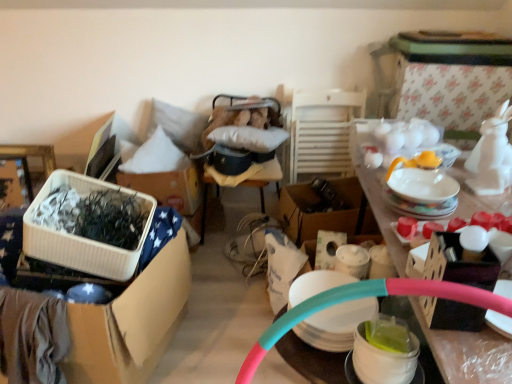
Question: Is cardboard box at center, placed as the first box when sorted from back to front, oriented away from white glossy table at upper right?

Choices:
 (A) no
 (B) yes

Answer: (A)

Question: Does cardboard box at center, the 2th box viewed from the front, have a smaller size compared to white glossy table at upper right?

Choices:
 (A) no
 (B) yes

Answer: (B)

Question: Is cardboard box at center, the 2th box viewed from the front, with white glossy table at upper right?

Choices:
 (A) no
 (B) yes

Answer: (A)

Question: Is cardboard box at center, the 1th box when ordered from right to left, oriented towards white glossy table at upper right?

Choices:
 (A) yes
 (B) no

Answer: (A)

Question: Is cardboard box at center, placed as the first box when sorted from back to front, at the right side of white glossy table at upper right?

Choices:
 (A) yes
 (B) no

Answer: (B)

Question: Does cardboard box at center, the 2th box viewed from the front, have a greater height compared to white glossy table at upper right?

Choices:
 (A) yes
 (B) no

Answer: (B)

Question: Is translucent plastic cups at center outside of white glossy table at upper right?

Choices:
 (A) no
 (B) yes

Answer: (B)

Question: Is translucent plastic cups at center smaller than white glossy table at upper right?

Choices:
 (A) yes
 (B) no

Answer: (A)

Question: Does translucent plastic cups at center lie in front of white glossy table at upper right?

Choices:
 (A) yes
 (B) no

Answer: (B)

Question: Is translucent plastic cups at center at the left side of white glossy table at upper right?

Choices:
 (A) yes
 (B) no

Answer: (A)

Question: Does translucent plastic cups at center have a greater height compared to white glossy table at upper right?

Choices:
 (A) no
 (B) yes

Answer: (A)

Question: Considering the relative sizes of translucent plastic cups at center and white glossy table at upper right in the image provided, is translucent plastic cups at center wider than white glossy table at upper right?

Choices:
 (A) yes
 (B) no

Answer: (B)

Question: From the image's perspective, would you say white glossy table at upper right is shown under white plastic container at left, which is counted as the 1th box, starting from the front?

Choices:
 (A) no
 (B) yes

Answer: (A)